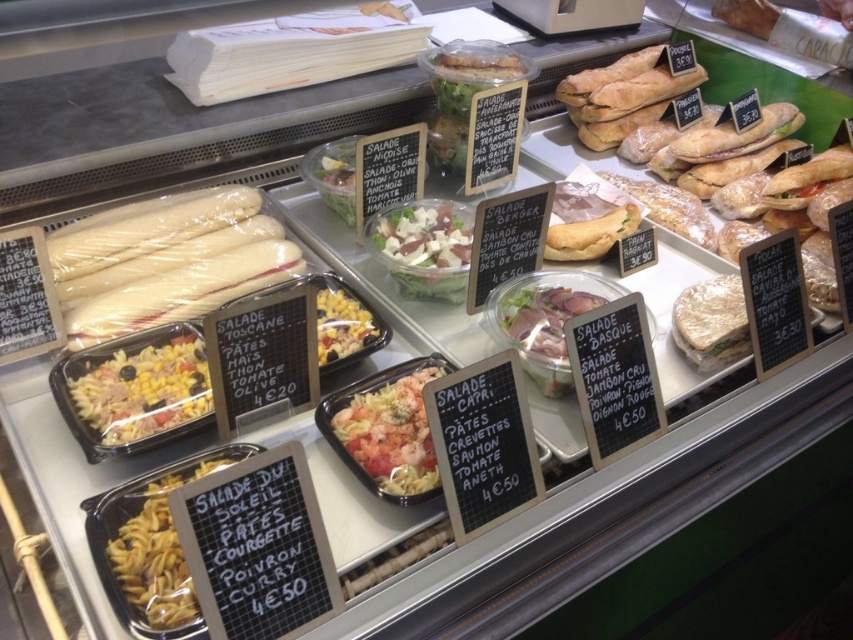
Which is behind, point (167, 576) or point (444, 266)?

The point (444, 266) is behind.

Consider the image. Who is positioned more to the left, yellow matte pasta at lower left or green leafy salad at center?

Positioned to the left is yellow matte pasta at lower left.

Who is more forward, (108,554) or (415,278)?

Point (108,554)

In order to click on yellow matte pasta at lower left in this screenshot , I will do `click(157, 556)`.

Does yellowish matte pasta at left appear on the right side of yellow matte pasta at lower left?

Incorrect, yellowish matte pasta at left is not on the right side of yellow matte pasta at lower left.

Consider the image. Does yellowish matte pasta at left appear under yellow matte pasta at lower left?

No, yellowish matte pasta at left is not below yellow matte pasta at lower left.

Which is behind, point (190, 340) or point (158, 536)?

The point (190, 340) is behind.

Identify the location of yellowish matte pasta at left. (143, 390).

Which is more to the right, matte brown salad at center or green leafy salad at center?

Positioned to the right is matte brown salad at center.

Is matte brown salad at center shorter than green leafy salad at center?

No.

Who is more distant from viewer, (572,312) or (445,214)?

Point (445,214)

Locate an element on the screen. The image size is (853, 640). matte brown salad at center is located at coordinates (544, 321).